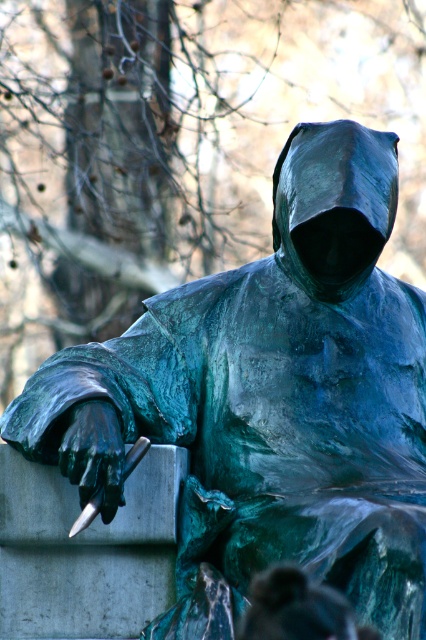
Question: In this image, where is green patina hood at center located relative to green patina statue at center?

Choices:
 (A) right
 (B) left

Answer: (A)

Question: Which point is closer to the camera?

Choices:
 (A) (313, 596)
 (B) (380, 172)

Answer: (A)

Question: Can you confirm if green patina hood at center is smaller than green patina statue at center?

Choices:
 (A) yes
 (B) no

Answer: (B)

Question: Which point appears farthest from the camera in this image?

Choices:
 (A) (344, 602)
 (B) (310, 220)

Answer: (B)

Question: Considering the relative positions of green patina hood at center and green patina statue at center in the image provided, where is green patina hood at center located with respect to green patina statue at center?

Choices:
 (A) left
 (B) right

Answer: (B)

Question: Among these points, which one is nearest to the camera?

Choices:
 (A) (388, 145)
 (B) (328, 605)

Answer: (B)